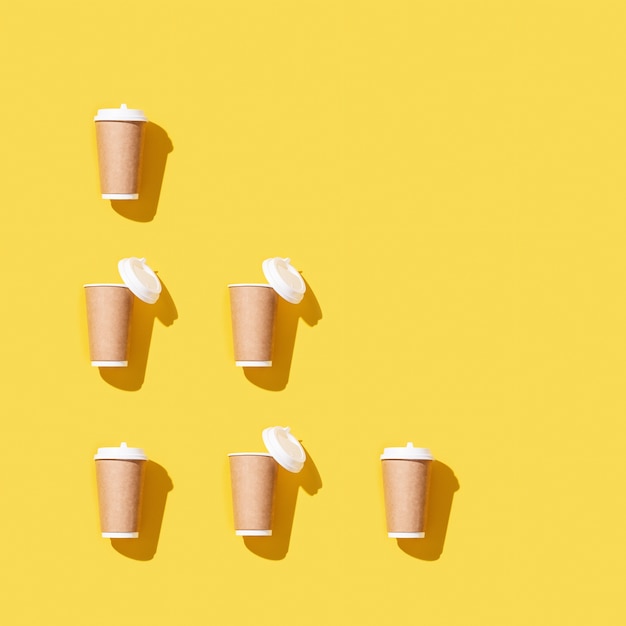
Where is `white bottom of cup`? white bottom of cup is located at coordinates (114, 197), (111, 362), (255, 362), (259, 534), (404, 534), (128, 536).